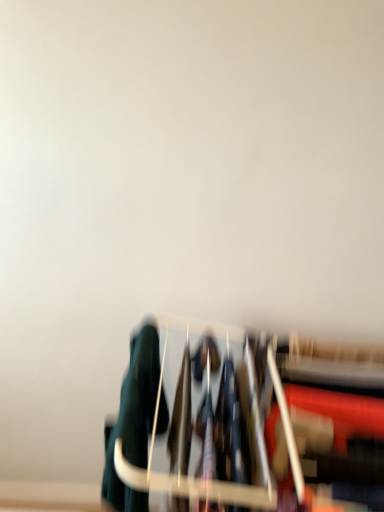
Question: Can you confirm if dark green fabric at lower left is positioned to the right of metallic silver rack at center?

Choices:
 (A) yes
 (B) no

Answer: (B)

Question: Does dark green fabric at lower left have a greater width compared to metallic silver rack at center?

Choices:
 (A) no
 (B) yes

Answer: (A)

Question: Does dark green fabric at lower left have a lesser height compared to metallic silver rack at center?

Choices:
 (A) yes
 (B) no

Answer: (A)

Question: Is dark green fabric at lower left to the left of metallic silver rack at center from the viewer's perspective?

Choices:
 (A) no
 (B) yes

Answer: (B)

Question: Would you say dark green fabric at lower left contains metallic silver rack at center?

Choices:
 (A) yes
 (B) no

Answer: (B)

Question: Does dark green fabric at lower left lie behind metallic silver rack at center?

Choices:
 (A) yes
 (B) no

Answer: (A)

Question: Are metallic silver rack at center and dark green fabric at lower left far apart?

Choices:
 (A) no
 (B) yes

Answer: (A)

Question: From a real-world perspective, is metallic silver rack at center below dark green fabric at lower left?

Choices:
 (A) no
 (B) yes

Answer: (B)

Question: Considering the relative sizes of metallic silver rack at center and dark green fabric at lower left in the image provided, is metallic silver rack at center taller than dark green fabric at lower left?

Choices:
 (A) no
 (B) yes

Answer: (B)

Question: Can you confirm if metallic silver rack at center is bigger than dark green fabric at lower left?

Choices:
 (A) no
 (B) yes

Answer: (B)

Question: Is metallic silver rack at center shorter than dark green fabric at lower left?

Choices:
 (A) yes
 (B) no

Answer: (B)

Question: From the image's perspective, is metallic silver rack at center on top of dark green fabric at lower left?

Choices:
 (A) no
 (B) yes

Answer: (A)

Question: Is metallic silver rack at center wider or thinner than dark green fabric at lower left?

Choices:
 (A) thin
 (B) wide

Answer: (B)